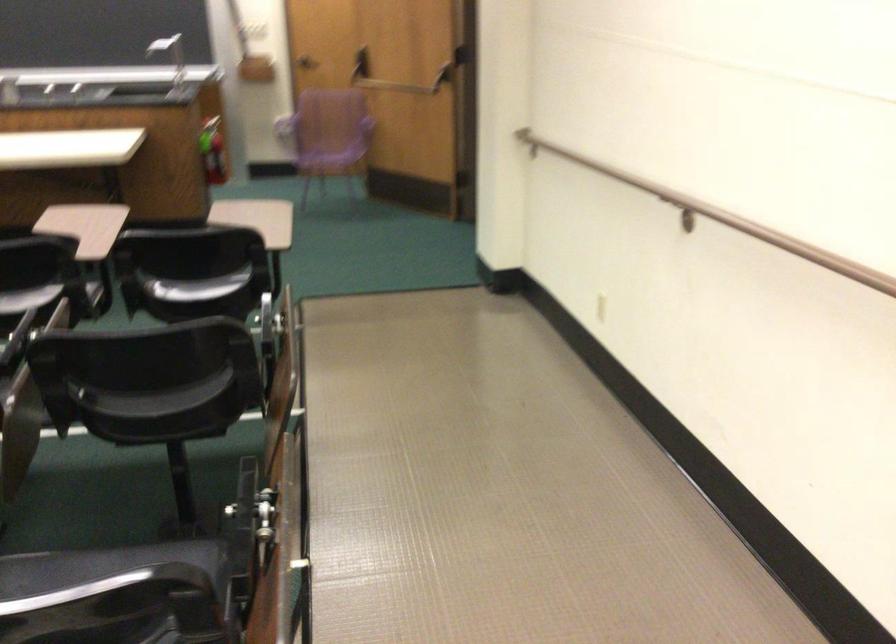
This screenshot has width=896, height=644. In order to click on purple chair armrest in this screenshot , I will do `click(251, 507)`.